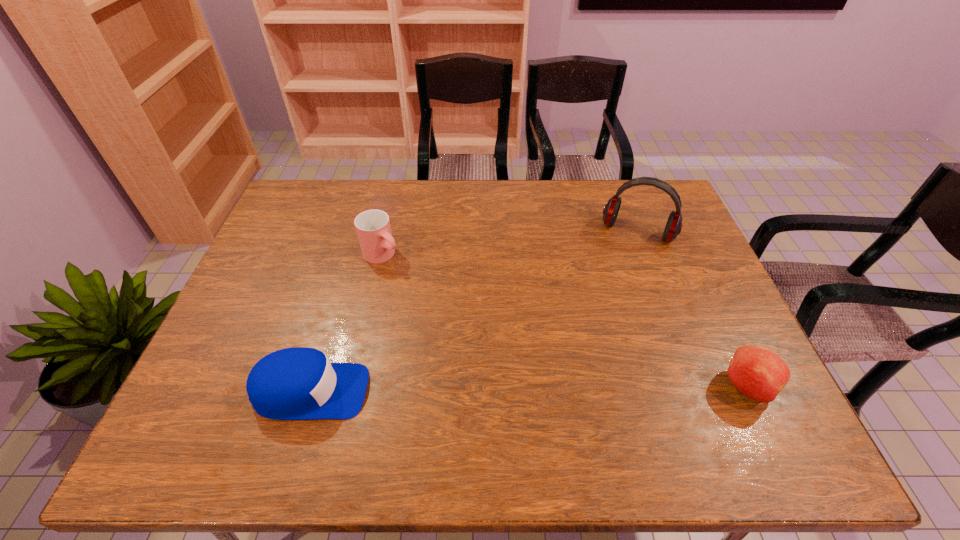
The height and width of the screenshot is (540, 960). I want to click on object present at the near right corner, so click(758, 373).

Where is `vacant space at the far edge of the desktop`? Image resolution: width=960 pixels, height=540 pixels. vacant space at the far edge of the desktop is located at coordinates (554, 213).

Image resolution: width=960 pixels, height=540 pixels. In order to click on free region at the near edge of the desktop in this screenshot , I will do `click(612, 390)`.

Where is `free region at the left edge of the desktop`? The height and width of the screenshot is (540, 960). free region at the left edge of the desktop is located at coordinates (235, 337).

The image size is (960, 540). I want to click on vacant space at the right edge of the desktop, so click(706, 339).

In the image, there is a desktop. Identify the location of free space at the far left corner. This screenshot has width=960, height=540. (304, 217).

Find the location of `free region at the far right corner`. free region at the far right corner is located at coordinates (624, 192).

Locate an element on the screen. The width and height of the screenshot is (960, 540). vacant space that's between the baseball cap and the earphone is located at coordinates (474, 312).

At what (x,y) coordinates should I click in order to perform the action: click on free space between the baseball cap and the cup. Please return your answer as a coordinate pair (x, y). Looking at the image, I should click on (347, 323).

Where is `blank region between the apple and the cup`? The width and height of the screenshot is (960, 540). blank region between the apple and the cup is located at coordinates pos(564,321).